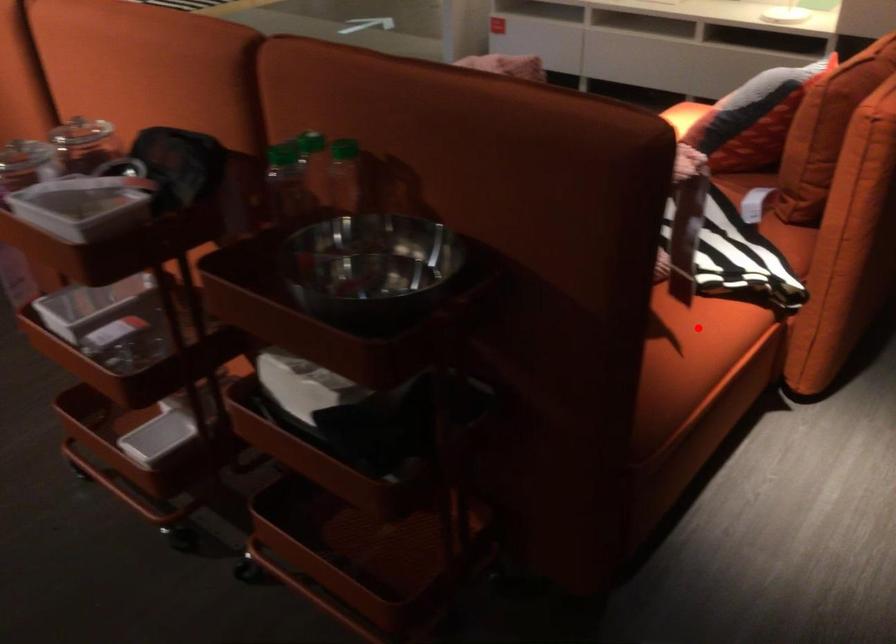
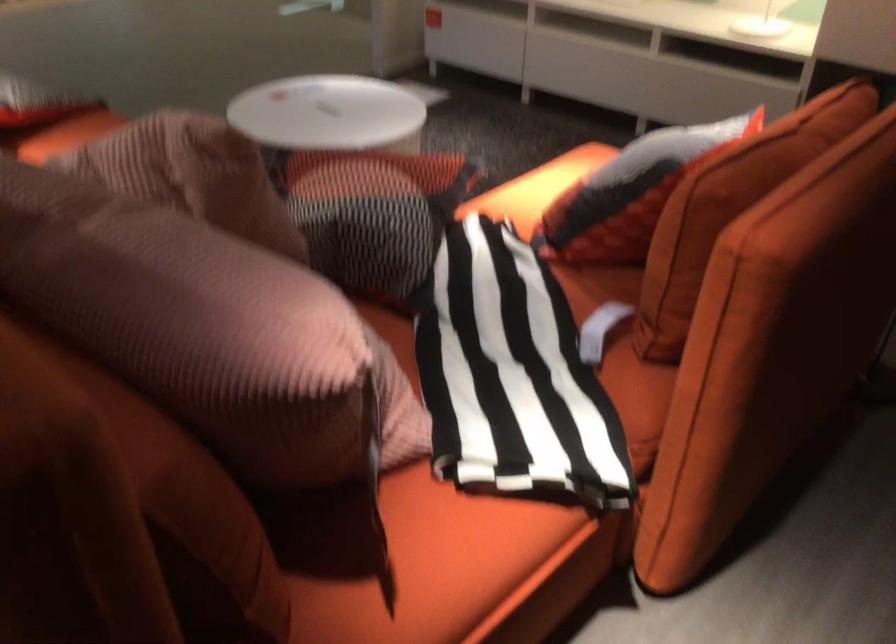
In the second image, find the point that corresponds to the highlighted location in the first image.

(434, 565)